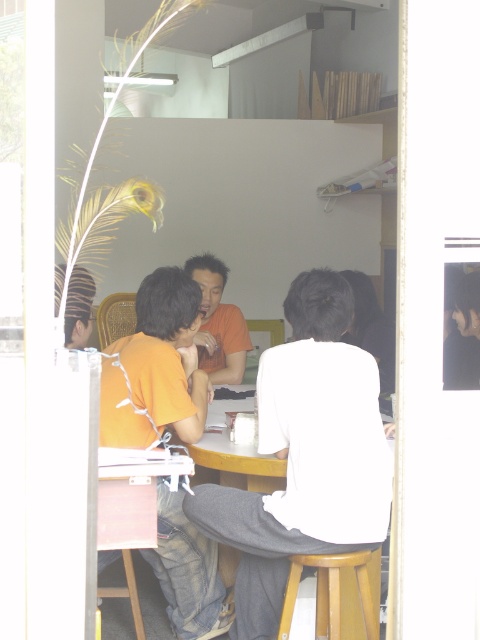
Question: Which object appears farthest from the camera in this image?

Choices:
 (A) wooden table at lower center
 (B) wooden stool at lower center
 (C) orange matte shirt at center

Answer: (C)

Question: Is the position of orange cotton shirt at center less distant than that of wooden stool at lower center?

Choices:
 (A) no
 (B) yes

Answer: (A)

Question: Estimate the real-world distances between objects in this image. Which object is farther from the white matte shirt at center?

Choices:
 (A) wooden table at lower center
 (B) orange cotton shirt at center
 (C) orange matte shirt at center

Answer: (C)

Question: Is wooden table at lower center closer to the viewer compared to wooden stool at lower center?

Choices:
 (A) no
 (B) yes

Answer: (B)

Question: Can you confirm if orange cotton shirt at center is positioned to the right of wooden stool at lower center?

Choices:
 (A) yes
 (B) no

Answer: (B)

Question: Among these points, which one is nearest to the camera?

Choices:
 (A) (214, 280)
 (B) (126, 573)

Answer: (B)